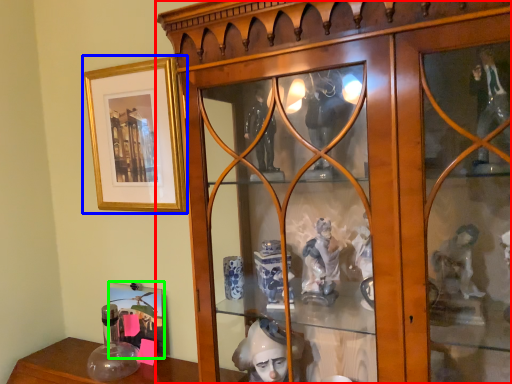
Question: Which object is positioned farthest from furniture (highlighted by a red box)? Select from picture frame (highlighted by a blue box) and picture frame (highlighted by a green box).

Choices:
 (A) picture frame
 (B) picture frame

Answer: (B)